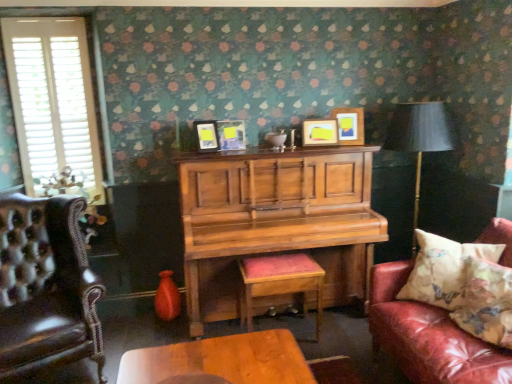
Question: Considering the positions of leather couch with floral pillow at right and matte yellow picture frame at upper right, the 4th picture frame viewed from the left, in the image, is leather couch with floral pillow at right bigger or smaller than matte yellow picture frame at upper right, the 4th picture frame viewed from the left,?

Choices:
 (A) big
 (B) small

Answer: (A)

Question: Is leather couch with floral pillow at right wider or thinner than matte yellow picture frame at upper right, the 1th picture frame in the right-to-left sequence?

Choices:
 (A) thin
 (B) wide

Answer: (B)

Question: Which is nearer to the matte black picture frame at center, which is counted as the 2th picture frame, starting from the left?

Choices:
 (A) wooden piano at center
 (B) matte black lampshade at right
 (C) leather couch with floral pillow at right
 (D) matte black picture frame at center, the first picture frame positioned from the left
 (E) leather tufted armchair at left

Answer: (D)

Question: Estimate the real-world distances between objects in this image. Which object is farther from the matte black lampshade at right?

Choices:
 (A) white wooden shutters at left
 (B) matte wooden picture frame at upper center, positioned as the 2th picture frame in right-to-left order
 (C) wooden cushioned stool at center
 (D) leather tufted armchair at left
 (E) floral fabric cushion at right, the 2th pillow positioned from the front

Answer: (A)